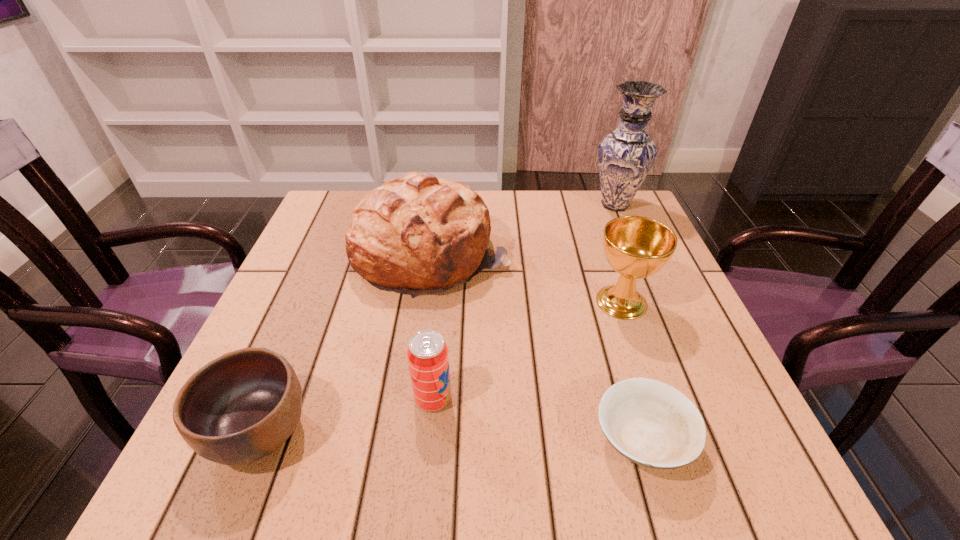
This screenshot has width=960, height=540. Identify the location of bowl that is positioned at the right edge. (651, 423).

Image resolution: width=960 pixels, height=540 pixels. In order to click on object positioned at the far left corner in this screenshot , I will do `click(415, 234)`.

You are a GUI agent. You are given a task and a screenshot of the screen. Output one action in this format:
    pyautogui.click(x=<x>, y=<y>)
    Task: Click on the object at the near left corner
    Image resolution: width=960 pixels, height=540 pixels.
    Given the screenshot: What is the action you would take?
    pyautogui.click(x=242, y=406)

Locate an element on the screen. The image size is (960, 540). object positioned at the far right corner is located at coordinates (625, 156).

Where is `object that is positioned at the near right corner`? This screenshot has height=540, width=960. object that is positioned at the near right corner is located at coordinates (651, 423).

In the image, there is a desktop. In order to click on free space at the far edge in this screenshot , I will do `click(576, 201)`.

Find the location of a particular element. vacant space at the near edge of the desktop is located at coordinates (516, 442).

Where is `vacant area at the left edge of the desktop`? Image resolution: width=960 pixels, height=540 pixels. vacant area at the left edge of the desktop is located at coordinates (300, 295).

Where is `vacant space at the right edge of the desktop`? This screenshot has height=540, width=960. vacant space at the right edge of the desktop is located at coordinates (635, 335).

The height and width of the screenshot is (540, 960). I want to click on vacant space at the far left corner of the desktop, so click(324, 206).